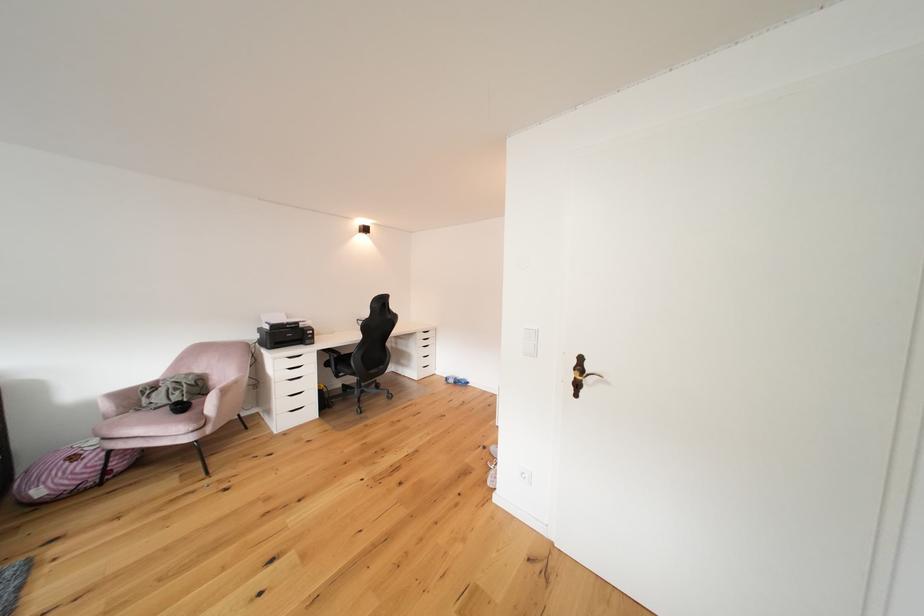
Where is `black chair sitting surface`? black chair sitting surface is located at coordinates (351, 361).